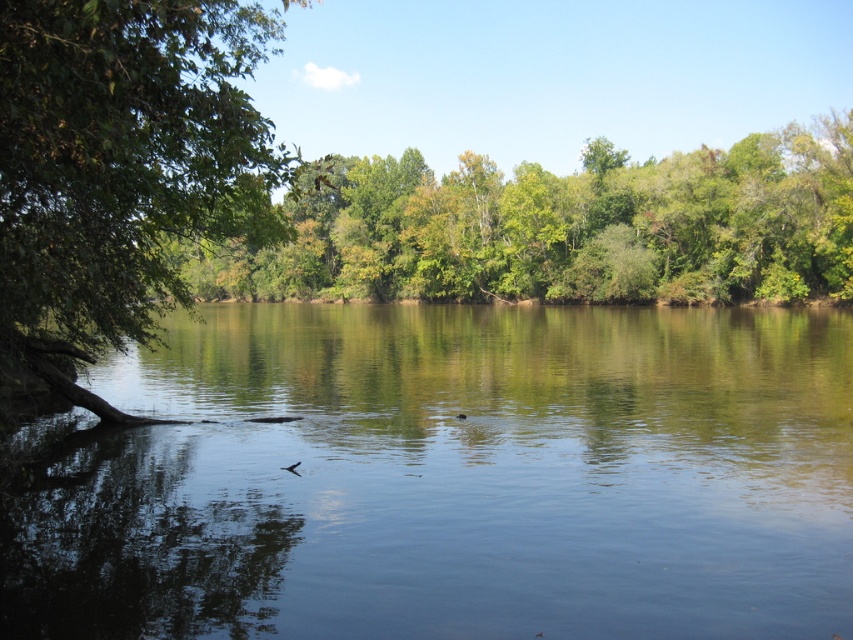
Based on the photo, you are observing the scene and want to know which tree is taller between the green leafy trees at center and the green leafy tree at left. Can you determine this?

The green leafy tree at left is taller than the green leafy trees at center.

You are standing at the edge of the water and want to take a photo of the clear water at center. Where should you position yourself to capture it best?

The clear water at center is located at point 0.748 on the x axis and 0.535 on the y axis, so you should position yourself directly facing that coordinate to capture it best.